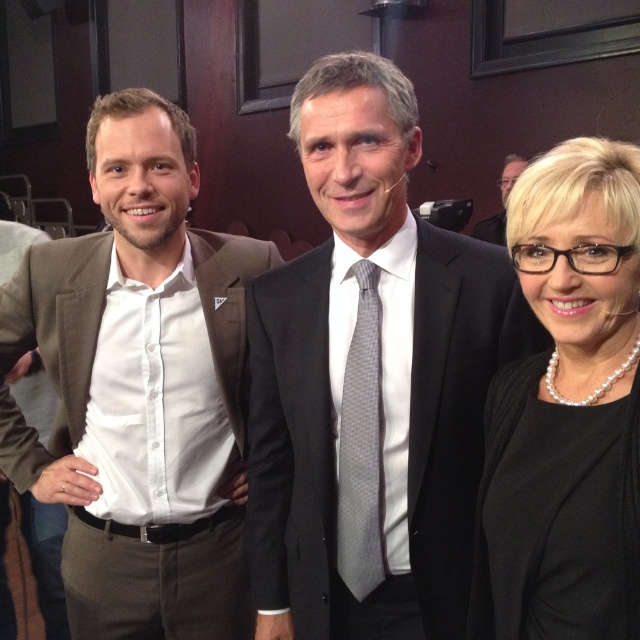
Can you confirm if black silk suit at center is positioned to the right of matte brown suit at left?

Correct, you'll find black silk suit at center to the right of matte brown suit at left.

I want to click on black silk suit at center, so click(x=371, y=381).

Does point (461, 516) come closer to viewer compared to point (246, 262)?

Yes, point (461, 516) is in front of point (246, 262).

At what (x,y) coordinates should I click in order to perform the action: click on black silk suit at center. Please return your answer as a coordinate pair (x, y). Looking at the image, I should click on [371, 381].

Is black silk suit at center positioned at the back of pearl necklace at center?

Yes, it is.

Who is positioned more to the right, black silk suit at center or pearl necklace at center?

pearl necklace at center is more to the right.

Between point (250, 554) and point (520, 275), which one is positioned behind?

The point (250, 554) is behind.

The height and width of the screenshot is (640, 640). Find the location of `black silk suit at center`. black silk suit at center is located at coordinates (371, 381).

Is gray dotted tie at center shorter than dark gray suit at center?

No, gray dotted tie at center is not shorter than dark gray suit at center.

Where is `gray dotted tie at center`? gray dotted tie at center is located at coordinates (360, 445).